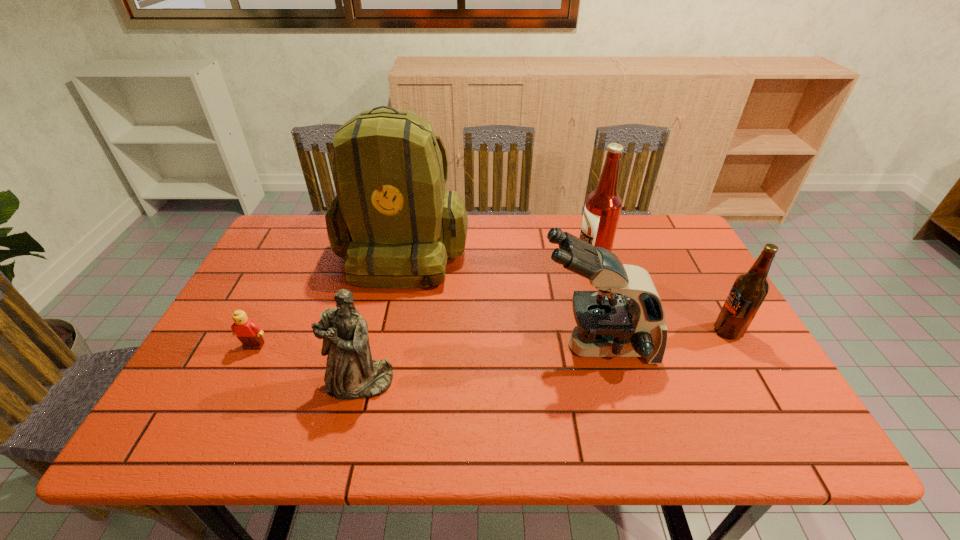
Find the location of a particular element. The width and height of the screenshot is (960, 540). alcohol located in the far edge section of the desktop is located at coordinates (603, 206).

Where is `object that is at the left edge`? This screenshot has height=540, width=960. object that is at the left edge is located at coordinates (249, 333).

This screenshot has width=960, height=540. I want to click on object located at the right edge, so click(749, 290).

In the image, there is a desktop. Where is `vacant space at the far edge`? vacant space at the far edge is located at coordinates (516, 215).

This screenshot has height=540, width=960. In order to click on vacant region at the near edge of the desktop in this screenshot , I will do coord(359,449).

In the image, there is a desktop. Identify the location of vacant space at the left edge. (195, 402).

In the image, there is a desktop. Where is `vacant space at the right edge`? The image size is (960, 540). vacant space at the right edge is located at coordinates click(x=762, y=364).

What are the coordinates of `vacant region at the far left corner of the desktop` in the screenshot? It's located at (283, 225).

I want to click on vacant space at the near right corner of the desktop, so click(x=770, y=447).

What are the coordinates of `vacant area that lies between the microscope and the figurine` in the screenshot? It's located at (478, 364).